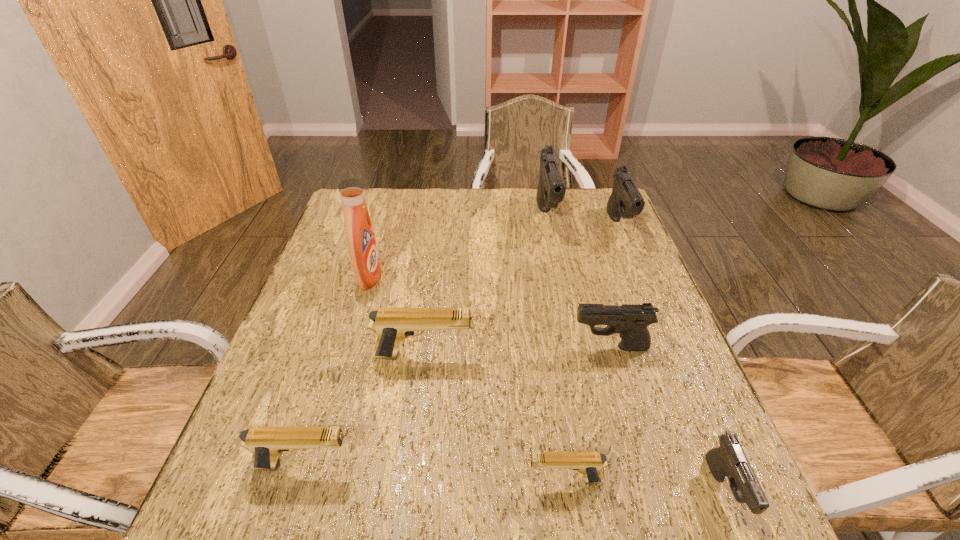
Find the location of a particular element. vacant space located 0.220m at the barrel of the shortest pistol is located at coordinates (404, 480).

At what (x,y) coordinates should I click in order to perform the action: click on vacant space located 0.100m at the barrel of the shortest pistol. Please return your answer as a coordinate pair (x, y). This screenshot has width=960, height=540. Looking at the image, I should click on (471, 480).

The image size is (960, 540). I want to click on vacant space located 0.270m at the barrel of the shortest pistol, so click(376, 480).

Identify the location of object present at the near edge. This screenshot has height=540, width=960. (729, 460).

You are a GUI agent. You are given a task and a screenshot of the screen. Output one action in this format:
    pyautogui.click(x=<x>, y=<y>)
    Task: Click on the detergent at the left edge
    
    Given the screenshot: What is the action you would take?
    pyautogui.click(x=362, y=246)

Identify the location of pistol present at the left edge. The height and width of the screenshot is (540, 960). (266, 444).

I want to click on object that is at the far right corner, so click(626, 201).

At what (x,y) coordinates should I click in order to perform the action: click on object situated at the near right corner. Please return your answer as a coordinate pair (x, y). Looking at the image, I should click on (729, 460).

I want to click on vacant region at the far edge of the desktop, so click(420, 198).

Identify the location of vacant area at the left edge. (298, 359).